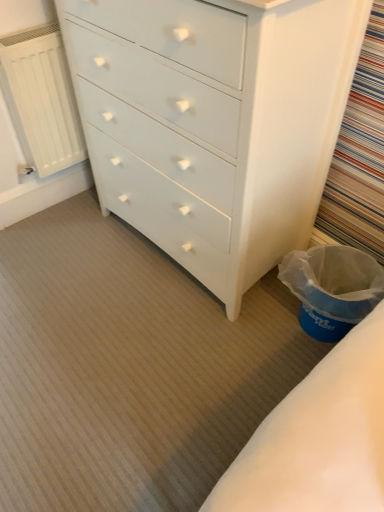
Question: Would you say white matte radiator at left is inside or outside white painted wood chest of drawers at center?

Choices:
 (A) inside
 (B) outside

Answer: (B)

Question: From the image's perspective, relative to white painted wood chest of drawers at center, is white matte radiator at left above or below?

Choices:
 (A) below
 (B) above

Answer: (B)

Question: Estimate the real-world distances between objects in this image. Which object is farther from the white painted wood chest of drawers at center?

Choices:
 (A) blue plastic laundry basket at lower right
 (B) white matte radiator at left

Answer: (B)

Question: Estimate the real-world distances between objects in this image. Which object is closer to the white matte radiator at left?

Choices:
 (A) blue plastic laundry basket at lower right
 (B) white painted wood chest of drawers at center

Answer: (B)